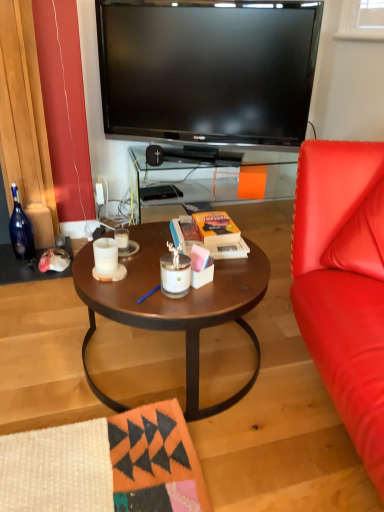
Question: Should I look upward or downward to see white matte candle at center, placed as the second coffee cup when sorted from back to front?

Choices:
 (A) up
 (B) down

Answer: (B)

Question: Is white matte candle at center, placed as the second coffee cup when sorted from back to front, positioned beyond the bounds of black plastic speaker at center?

Choices:
 (A) yes
 (B) no

Answer: (A)

Question: Is there a large distance between white matte candle at center, placed as the second coffee cup when sorted from back to front, and black plastic speaker at center?

Choices:
 (A) no
 (B) yes

Answer: (B)

Question: Considering the relative sizes of white matte candle at center, which appears as the first coffee cup when viewed from the front, and black plastic speaker at center in the image provided, is white matte candle at center, which appears as the first coffee cup when viewed from the front, wider than black plastic speaker at center?

Choices:
 (A) no
 (B) yes

Answer: (A)

Question: Is white matte candle at center, which appears as the first coffee cup when viewed from the front, in contact with black plastic speaker at center?

Choices:
 (A) no
 (B) yes

Answer: (A)

Question: Is white matte candle at center, which appears as the first coffee cup when viewed from the front, shorter than black plastic speaker at center?

Choices:
 (A) no
 (B) yes

Answer: (B)

Question: Considering the relative sizes of white matte candle at center, which appears as the first coffee cup when viewed from the front, and black plastic speaker at center in the image provided, is white matte candle at center, which appears as the first coffee cup when viewed from the front, smaller than black plastic speaker at center?

Choices:
 (A) no
 (B) yes

Answer: (B)

Question: Can white matte candle at center, which is counted as the 1th coffee cup, starting from the back, be found inside orange matte book at center?

Choices:
 (A) yes
 (B) no

Answer: (B)

Question: Can you confirm if orange matte book at center is thinner than white matte candle at center, which is counted as the 1th coffee cup, starting from the back?

Choices:
 (A) no
 (B) yes

Answer: (A)

Question: Does orange matte book at center come behind white matte candle at center, the second coffee cup when ordered from front to back?

Choices:
 (A) yes
 (B) no

Answer: (B)

Question: Is there a large distance between orange matte book at center and white matte candle at center, the second coffee cup when ordered from front to back?

Choices:
 (A) yes
 (B) no

Answer: (B)

Question: Is orange matte book at center not inside white matte candle at center, the second coffee cup when ordered from front to back?

Choices:
 (A) yes
 (B) no

Answer: (A)

Question: Can you confirm if orange matte book at center is bigger than white matte candle at center, the second coffee cup when ordered from front to back?

Choices:
 (A) no
 (B) yes

Answer: (B)

Question: From the image's perspective, is white matte candle at center, which appears as the first coffee cup when viewed from the front, on matte brown coffee table at center?

Choices:
 (A) no
 (B) yes

Answer: (B)